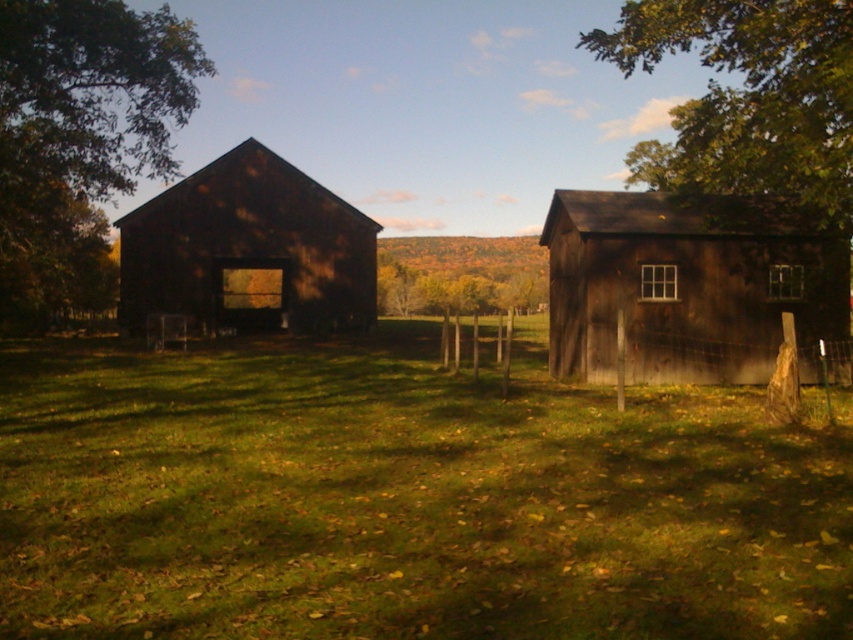
Question: Is dark wood barn at right in front of yellow autumn leaves at center?

Choices:
 (A) no
 (B) yes

Answer: (B)

Question: Which object is closer to the camera taking this photo?

Choices:
 (A) green leafy tree at left
 (B) dark brown wooden barn at center
 (C) dark wood barn at right
 (D) yellow autumn leaves at center

Answer: (C)

Question: Among these points, which one is nearest to the camera?

Choices:
 (A) (674, 353)
 (B) (434, 273)

Answer: (A)

Question: Is green grass at center below green leafy tree at left?

Choices:
 (A) yes
 (B) no

Answer: (A)

Question: Which is farther from the green leafy tree at left?

Choices:
 (A) yellow autumn leaves at center
 (B) green leafy tree at upper right
 (C) green grass at center

Answer: (B)

Question: Does green grass at center appear under yellow autumn leaves at center?

Choices:
 (A) no
 (B) yes

Answer: (B)